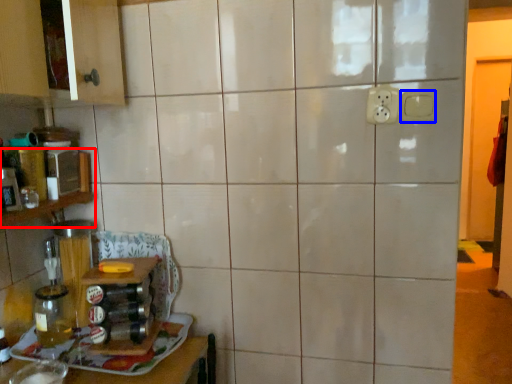
Question: Among these objects, which one is nearest to the camera, shelf (highlighted by a red box) or electric outlet (highlighted by a blue box)?

Choices:
 (A) shelf
 (B) electric outlet

Answer: (A)